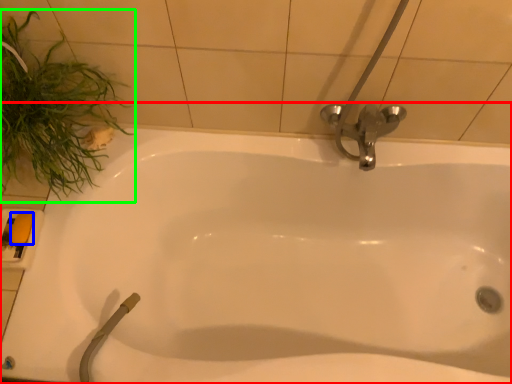
Question: Which object is the closest to the bathtub (highlighted by a red box)? Choose among these: soap (highlighted by a blue box) or plant (highlighted by a green box).

Choices:
 (A) soap
 (B) plant

Answer: (B)